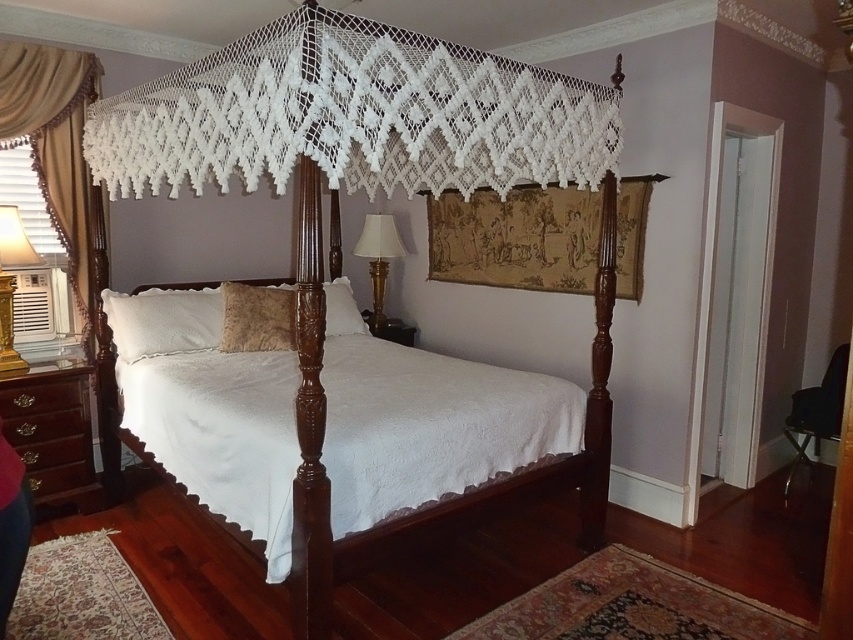
You are standing in the bedroom and want to move from the beige satin curtain at left to the white fluffy pillow at center. Which direction should you move to reach the pillow?

The beige satin curtain at left is positioned on the left side of the white fluffy pillow at center, so you should move to the right to reach the pillow.

You are standing in the bedroom and want to locate the polished dark wood bed at center. According to the coordinates provided, where should you look?

The polished dark wood bed at center is located at coordinates point (372, 193).